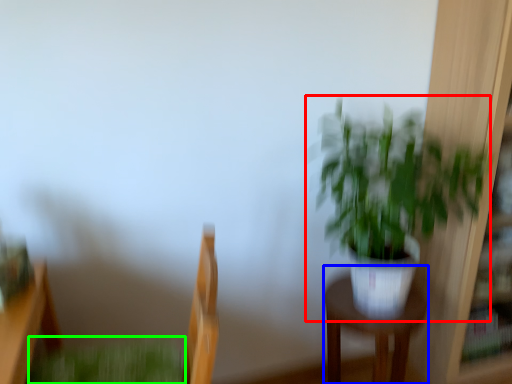
Question: Estimate the real-world distances between objects in this image. Which object is closer to houseplant (highlighted by a red box), furniture (highlighted by a blue box) or plant (highlighted by a green box)?

Choices:
 (A) furniture
 (B) plant

Answer: (A)